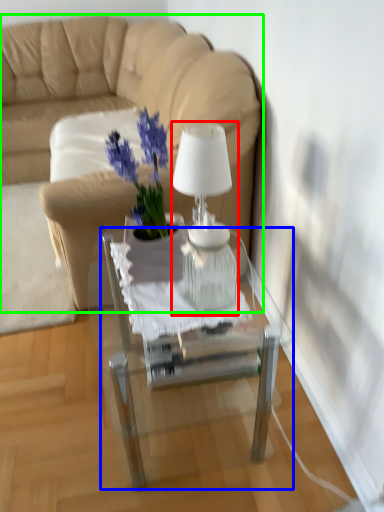
Question: Based on their relative distances, which object is farther from lamp (highlighted by a red box)? Choose from table (highlighted by a blue box) and studio couch (highlighted by a green box).

Choices:
 (A) table
 (B) studio couch

Answer: (B)